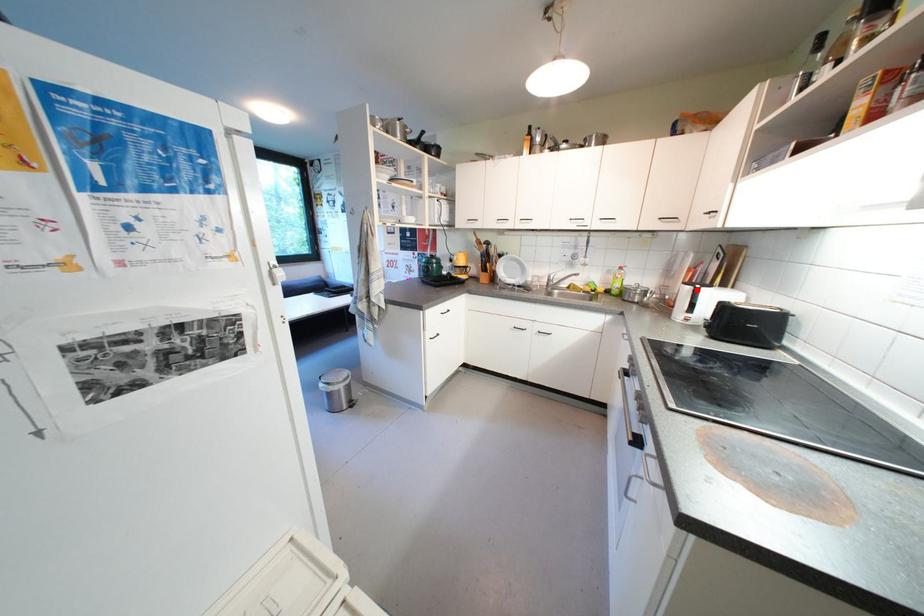
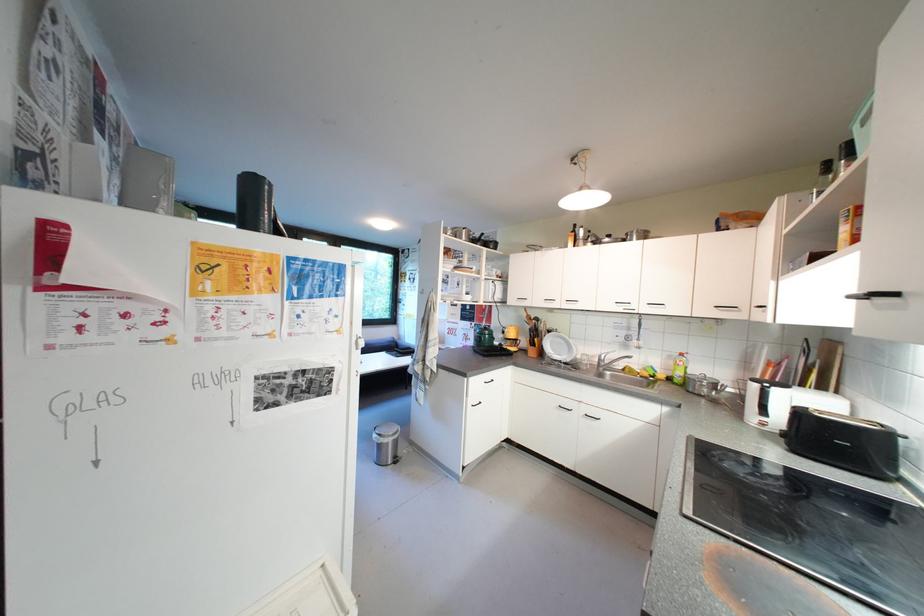
Find the pixel in the second image that matches the highlighted location in the first image.

(763, 387)